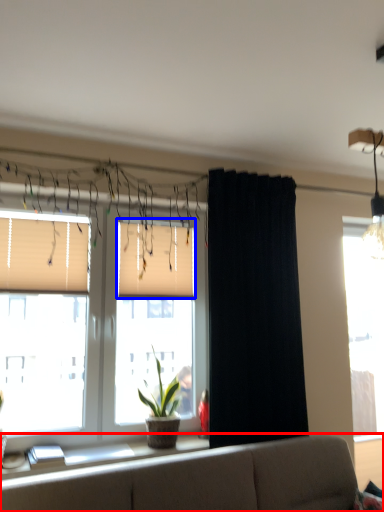
Question: Among these objects, which one is nearest to the camera, studio couch (highlighted by a red box) or window blind (highlighted by a blue box)?

Choices:
 (A) studio couch
 (B) window blind

Answer: (A)